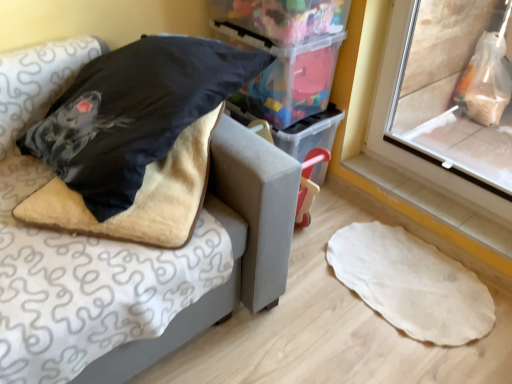
Consider the image. What is the approximate height of white felt rug at lower right?

3.10 centimeters.

Find the location of a particular element. Image resolution: width=512 pixels, height=384 pixels. white tile at lower right is located at coordinates (434, 203).

You are a GUI agent. You are given a task and a screenshot of the screen. Output one action in this format:
    pyautogui.click(x=<x>, y=<y>)
    Task: Click on the fuzzy beige blanket at left
    The height and width of the screenshot is (384, 512).
    Given the screenshot: What is the action you would take?
    pyautogui.click(x=139, y=196)

You are a GUI agent. You are given a task and a screenshot of the screen. Output one action in this format:
    pyautogui.click(x=<x>, y=<y>)
    Task: Click on the velvet-like beige cushion at upper left
    
    Given the screenshot: What is the action you would take?
    pyautogui.click(x=127, y=247)

Considering the relative sizes of velvet-like beige cushion at upper left and fuzzy beige blanket at left in the image provided, is velvet-like beige cushion at upper left taller than fuzzy beige blanket at left?

Correct, velvet-like beige cushion at upper left is much taller as fuzzy beige blanket at left.

Can you confirm if velvet-like beige cushion at upper left is bigger than fuzzy beige blanket at left?

Indeed, velvet-like beige cushion at upper left has a larger size compared to fuzzy beige blanket at left.

Considering the positions of objects velvet-like beige cushion at upper left and fuzzy beige blanket at left in the image provided, who is more to the right, velvet-like beige cushion at upper left or fuzzy beige blanket at left?

fuzzy beige blanket at left is more to the right.

Considering the points (36, 92) and (185, 203), which point is in front, point (36, 92) or point (185, 203)?

The point (185, 203) is in front.

From the image's perspective, is white tile at lower right located beneath white felt rug at lower right?

Incorrect, from the image's perspective, white tile at lower right is higher than white felt rug at lower right.

Could you tell me if white tile at lower right is turned towards white felt rug at lower right?

No, white tile at lower right is not turned towards white felt rug at lower right.

Between white tile at lower right and white felt rug at lower right, which one has larger width?

white felt rug at lower right.

How far apart are white tile at lower right and white felt rug at lower right?

A distance of 26.59 centimeters exists between white tile at lower right and white felt rug at lower right.

Is velvet black pillow at upper left located outside translucent plastic storage box at upper center?

Yes, velvet black pillow at upper left is outside of translucent plastic storage box at upper center.

Can you confirm if velvet black pillow at upper left is wider than translucent plastic storage box at upper center?

Indeed, velvet black pillow at upper left has a greater width compared to translucent plastic storage box at upper center.

Is translucent plastic storage box at upper center at the back of velvet black pillow at upper left?

Yes, velvet black pillow at upper left is facing away from translucent plastic storage box at upper center.

Which object is positioned more to the right, velvet black pillow at upper left or translucent plastic storage box at upper center?

Positioned to the right is translucent plastic storage box at upper center.

From the image's perspective, is velvet black pillow at upper left above or below white felt rug at lower right?

Based on their image positions, velvet black pillow at upper left is located above white felt rug at lower right.

From the picture: Is velvet black pillow at upper left positioned before white felt rug at lower right?

Yes, it is.

Is velvet black pillow at upper left to the left or to the right of white felt rug at lower right in the image?

velvet black pillow at upper left is to the left of white felt rug at lower right.

Where is `linen behind the velvet black pillow at upper left`? The width and height of the screenshot is (512, 384). linen behind the velvet black pillow at upper left is located at coordinates (411, 283).

Is white felt rug at lower right placed right next to transparent plastic window screen at right?

No.

Is transparent plastic window screen at right surrounded by white felt rug at lower right?

No, transparent plastic window screen at right is not surrounded by white felt rug at lower right.

From the picture: Can you tell me how much white felt rug at lower right and transparent plastic window screen at right differ in facing direction?

There is a 0.19-degree angle between the facing directions of white felt rug at lower right and transparent plastic window screen at right.

Is white felt rug at lower right wider or thinner than transparent plastic window screen at right?

In the image, white felt rug at lower right appears to be wider than transparent plastic window screen at right.

Considering the positions of point (319, 88) and point (435, 265), is point (319, 88) closer or farther from the camera than point (435, 265)?

Clearly, point (319, 88) is more distant from the camera than point (435, 265).

Image resolution: width=512 pixels, height=384 pixels. I want to click on linen below the translucent plastic storage box at upper center (from the image's perspective), so click(x=411, y=283).

From the picture: From the image's perspective, is translucent plastic storage box at upper center on white felt rug at lower right?

Yes, from the image's perspective, translucent plastic storage box at upper center is over white felt rug at lower right.

Is point (350, 262) positioned after point (8, 207)?

Yes, point (350, 262) is farther from viewer.

Are white felt rug at lower right and velvet-like beige cushion at upper left making contact?

No, white felt rug at lower right is not touching velvet-like beige cushion at upper left.

Is white felt rug at lower right further to the viewer compared to velvet-like beige cushion at upper left?

Yes, it is.

Which is more to the right, white felt rug at lower right or velvet-like beige cushion at upper left?

white felt rug at lower right.

This screenshot has width=512, height=384. Identify the location of furniture that appears on the left of fuzzy beige blanket at left. (127, 247).

Where is `window sill on the right of the white felt rug at lower right`? window sill on the right of the white felt rug at lower right is located at coordinates (434, 203).

Looking at the image, which one is located further to velvet black pillow at upper left, white tile at lower right or translucent plastic storage box at upper center?

white tile at lower right lies further to velvet black pillow at upper left than the other object.

Which object lies nearer to the anchor point fuzzy beige blanket at left, transparent plastic window screen at right or white tile at lower right?

white tile at lower right.

Looking at the image, which one is located closer to translucent plastic storage box at upper center, fuzzy beige blanket at left or transparent plastic window screen at right?

fuzzy beige blanket at left is positioned closer to the anchor translucent plastic storage box at upper center.

Looking at this image, estimate the real-world distances between objects in this image. Which object is further from velvet black pillow at upper left, transparent plastic window screen at right or velvet-like beige cushion at upper left?

Among the two, transparent plastic window screen at right is located further to velvet black pillow at upper left.

Which object lies nearer to the anchor point velvet black pillow at upper left, fuzzy beige blanket at left or transparent plastic window screen at right?

fuzzy beige blanket at left is closer to velvet black pillow at upper left.

Estimate the real-world distances between objects in this image. Which object is closer to velvet black pillow at upper left, transparent plastic window screen at right or translucent plastic storage box at upper center?

Based on the image, translucent plastic storage box at upper center appears to be nearer to velvet black pillow at upper left.

Consider the image. Based on their spatial positions, is translucent plastic storage box at upper center or white felt rug at lower right closer to velvet-like beige cushion at upper left?

The object closer to velvet-like beige cushion at upper left is translucent plastic storage box at upper center.

Looking at the image, which one is located closer to fuzzy beige blanket at left, translucent plastic storage box at upper center or velvet black pillow at upper left?

velvet black pillow at upper left is closer to fuzzy beige blanket at left.

Identify the location of window sill between velvet-like beige cushion at upper left and transparent plastic window screen at right. Image resolution: width=512 pixels, height=384 pixels. (434, 203).

Where is `blanket between velvet-like beige cushion at upper left and white felt rug at lower right in the horizontal direction`? This screenshot has height=384, width=512. blanket between velvet-like beige cushion at upper left and white felt rug at lower right in the horizontal direction is located at coordinates (139, 196).

The image size is (512, 384). In order to click on storage box situated between fuzzy beige blanket at left and white tile at lower right from left to right in this screenshot , I will do `click(287, 75)`.

Locate an element on the screen. The width and height of the screenshot is (512, 384). pillow situated between velvet-like beige cushion at upper left and transparent plastic window screen at right from left to right is located at coordinates (134, 113).